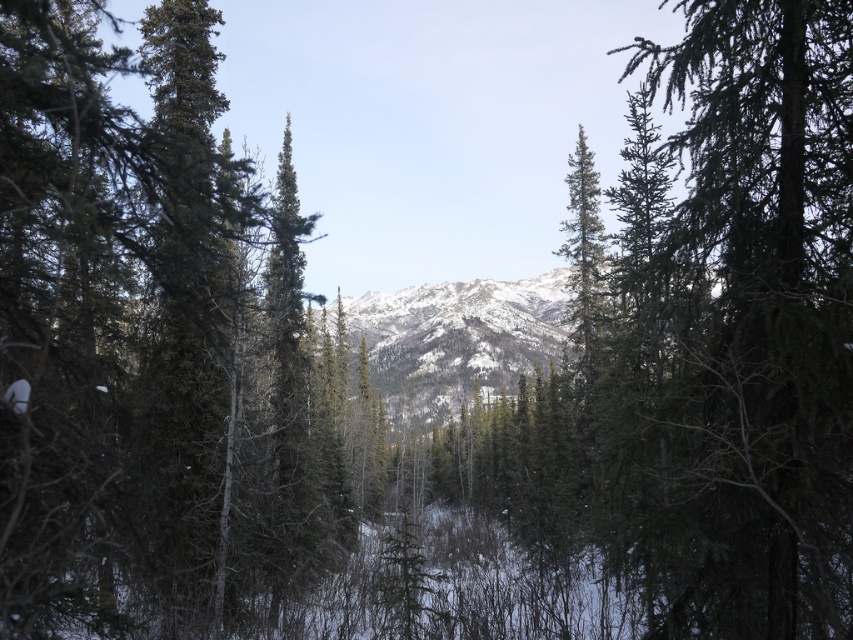
Question: Which point appears farthest from the camera in this image?

Choices:
 (A) (762, 317)
 (B) (154, 208)

Answer: (A)

Question: Is green matte tree at left to the left of green needle-like at right from the viewer's perspective?

Choices:
 (A) no
 (B) yes

Answer: (B)

Question: Can you confirm if green matte tree at left is bigger than green needle-like at right?

Choices:
 (A) no
 (B) yes

Answer: (B)

Question: Is green matte tree at left to the left of green needle-like at right from the viewer's perspective?

Choices:
 (A) yes
 (B) no

Answer: (A)